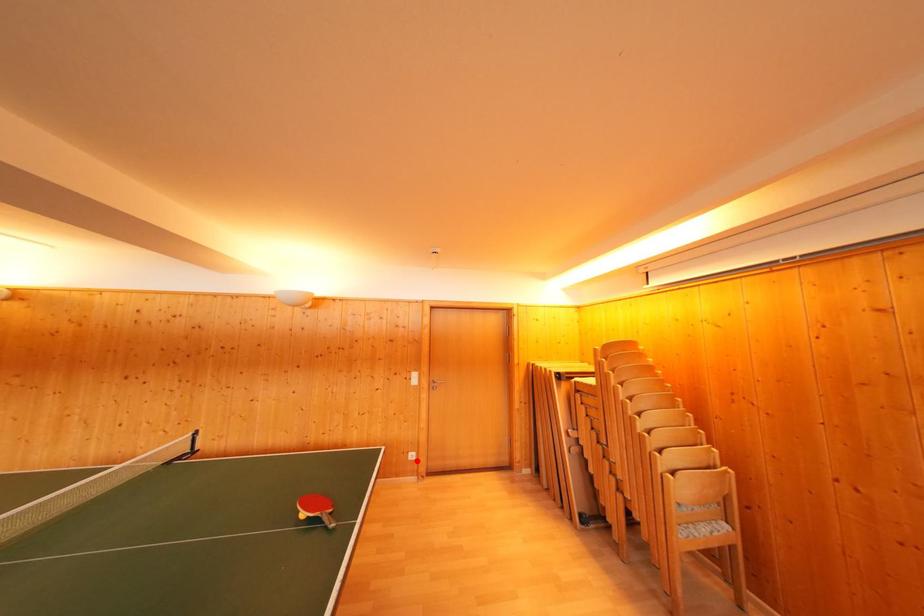
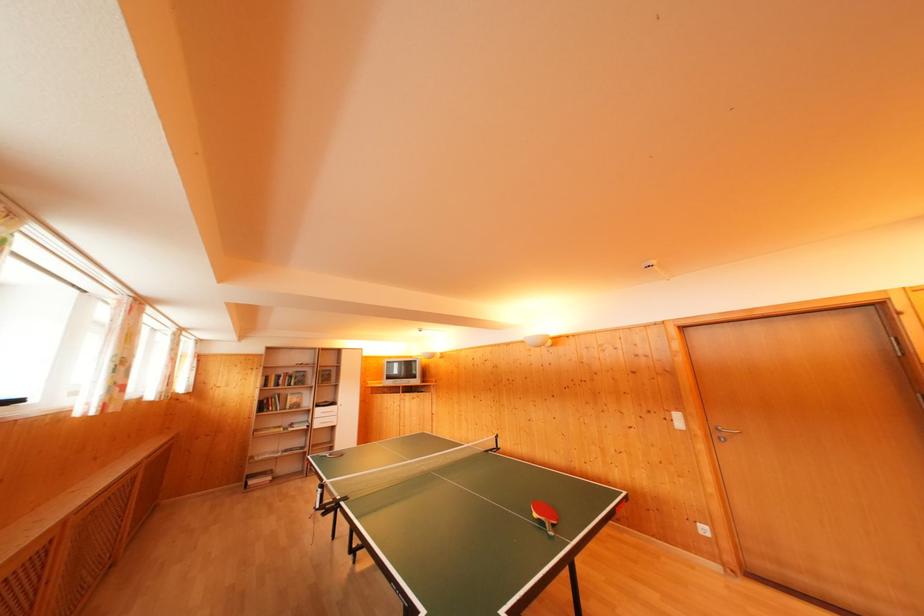
The point at the highlighted location is marked in the first image. Where is the corresponding point in the second image?

(709, 535)